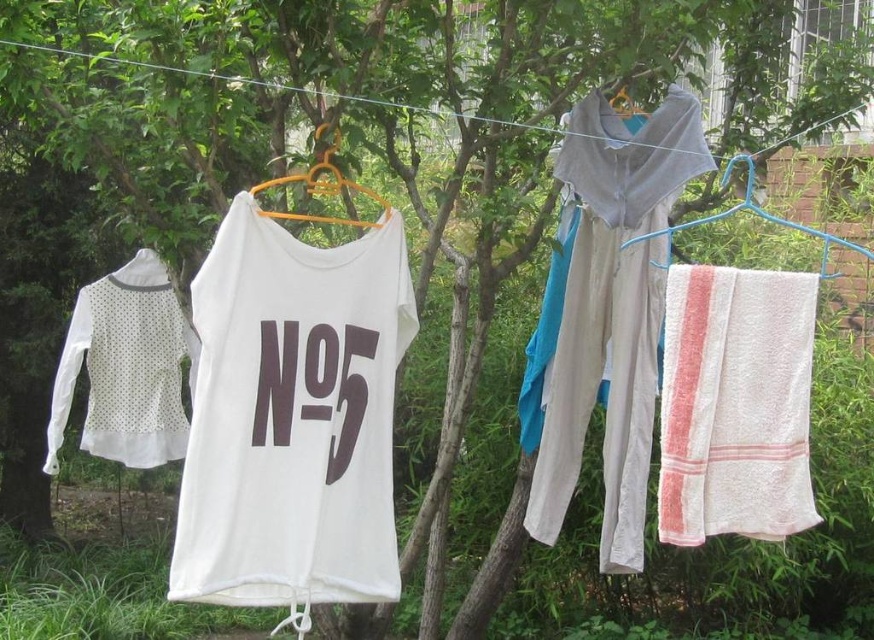
Is white cotton t-shirt at center thinner than white cotton shirt at upper center?

No.

Which is below, white cotton t-shirt at center or white cotton shirt at upper center?

Positioned lower is white cotton t-shirt at center.

I want to click on white cotton t-shirt at center, so click(292, 417).

Which is below, white textured towel at right or orange plastic hanger at center?

white textured towel at right

This screenshot has width=874, height=640. Describe the element at coordinates (734, 404) in the screenshot. I see `white textured towel at right` at that location.

Find the location of a particular element. The height and width of the screenshot is (640, 874). white textured towel at right is located at coordinates (734, 404).

Is point (274, 212) positioned in front of point (637, 108)?

Yes, point (274, 212) is in front of point (637, 108).

What do you see at coordinates (323, 188) in the screenshot? The width and height of the screenshot is (874, 640). I see `orange plastic hanger at center` at bounding box center [323, 188].

Locate an element on the screen. Image resolution: width=874 pixels, height=640 pixels. orange plastic hanger at center is located at coordinates (323, 188).